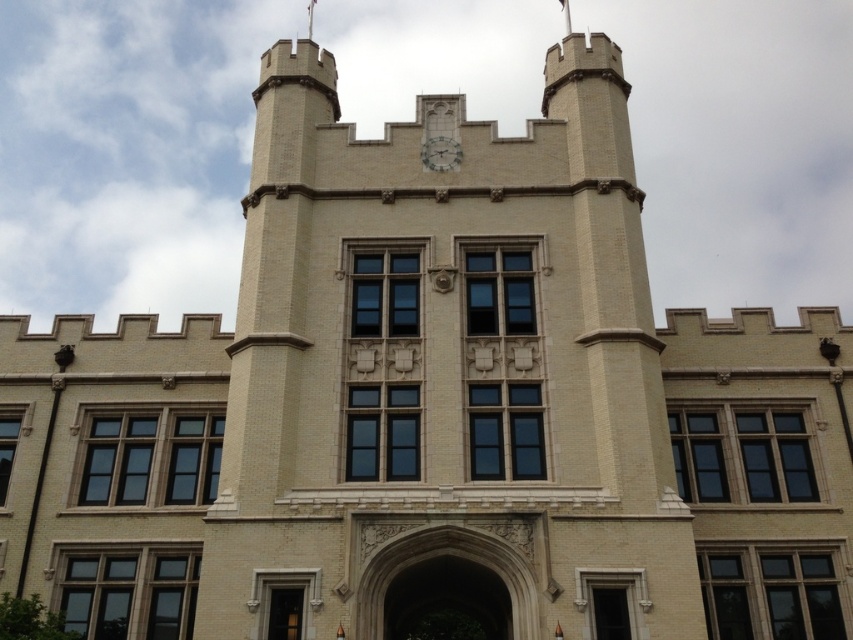
The width and height of the screenshot is (853, 640). What do you see at coordinates (440, 154) in the screenshot? I see `white glossy clock at center` at bounding box center [440, 154].

Between point (450, 163) and point (316, 1), which one is positioned behind?

Positioned behind is point (316, 1).

Is point (437, 134) more distant than point (309, 1)?

That is False.

Image resolution: width=853 pixels, height=640 pixels. I want to click on white glossy clock at center, so click(440, 154).

Find the location of a particular element. This screenshot has height=640, width=853. white brick tower at center is located at coordinates (445, 372).

Is point (399, 435) in front of point (308, 8)?

Yes, point (399, 435) is in front of point (308, 8).

Image resolution: width=853 pixels, height=640 pixels. What are the coordinates of `white brick tower at center` in the screenshot? It's located at (445, 372).

Is point (325, 413) closer to camera compared to point (434, 157)?

Yes, it is.

Is white brick tower at center positioned before white glossy clock at center?

Yes, it is in front of white glossy clock at center.

At what (x,y) coordinates should I click in order to perform the action: click on white brick tower at center. Please return your answer as a coordinate pair (x, y). Looking at the image, I should click on (445, 372).